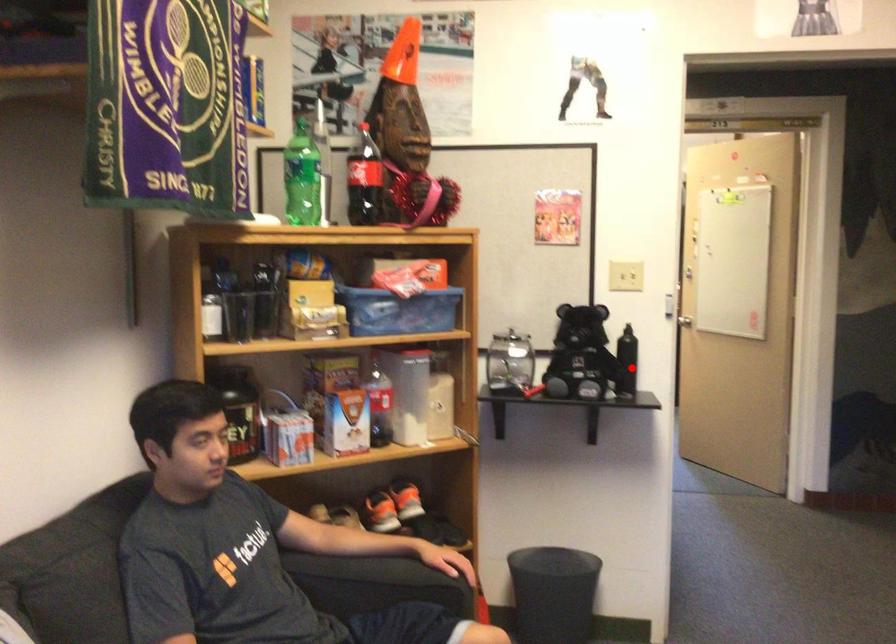
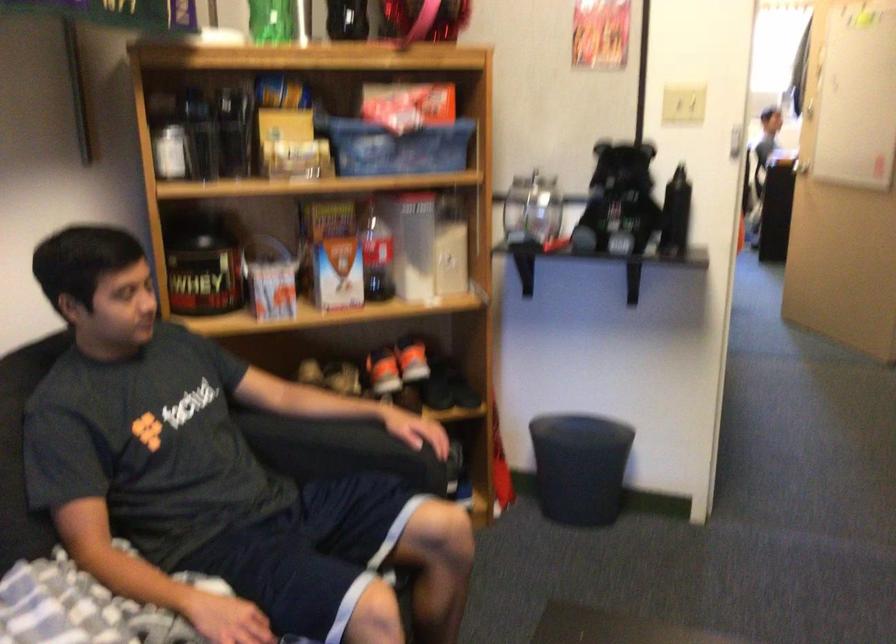
Where in the second image is the point corresponding to the highlighted location from the first image?

(675, 214)